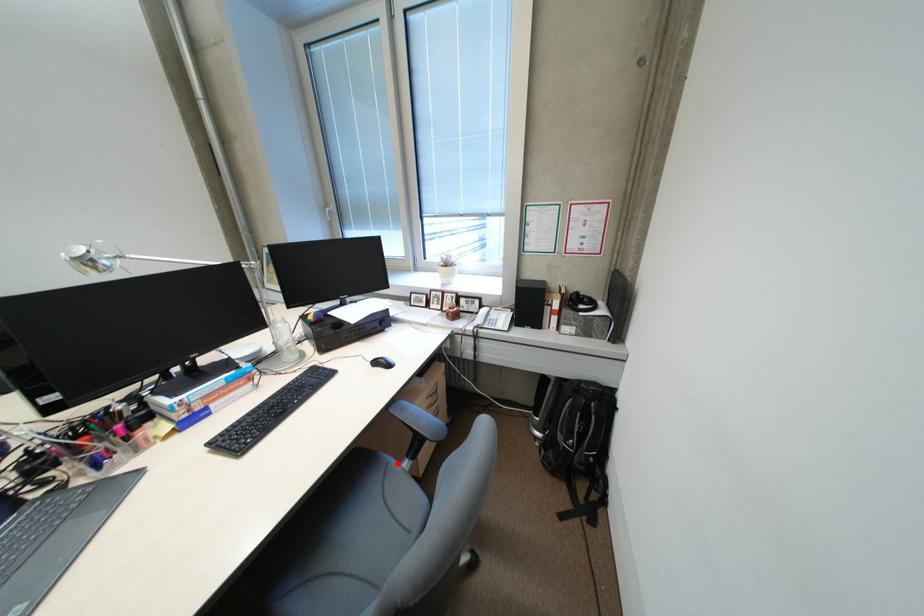
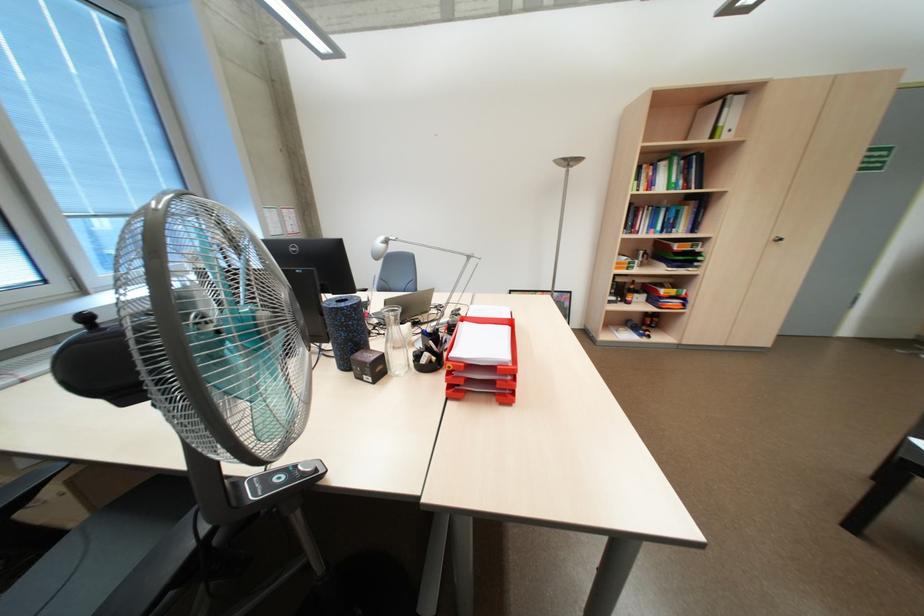
Question: I am providing you with two images of the same scene from different viewpoints. A red point is marked on the first image. Can you still see the location of the red point in image 2?

Choices:
 (A) Yes
 (B) No

Answer: (B)